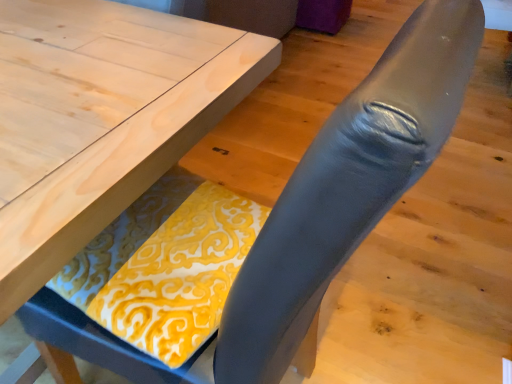
Describe the element at coordinates (165, 265) in the screenshot. This screenshot has width=512, height=384. I see `yellow printed fabric at lower center` at that location.

Locate an element on the screen. The width and height of the screenshot is (512, 384). yellow printed fabric at lower center is located at coordinates tap(165, 265).

What is the approximate width of light wood table at center?

33.26 inches.

I want to click on light wood table at center, so click(101, 118).

Image resolution: width=512 pixels, height=384 pixels. Describe the element at coordinates (101, 118) in the screenshot. I see `light wood table at center` at that location.

Find the location of a particular element. The width and height of the screenshot is (512, 384). yellow printed fabric at lower center is located at coordinates (165, 265).

From the picture: Does yellow printed fabric at lower center appear on the left side of light wood table at center?

No, yellow printed fabric at lower center is not to the left of light wood table at center.

Is the depth of yellow printed fabric at lower center greater than that of light wood table at center?

Yes, yellow printed fabric at lower center is further from the camera.

In the scene shown: Which is less distant, (155, 283) or (136, 50)?

Positioned in front is point (155, 283).

Based on the photo, from the image's perspective, would you say yellow printed fabric at lower center is shown under light wood table at center?

Yes, from the image's perspective, yellow printed fabric at lower center is beneath light wood table at center.

From a real-world perspective, does yellow printed fabric at lower center stand above light wood table at center?

Yes, from a real-world perspective, yellow printed fabric at lower center is on top of light wood table at center.

Between yellow printed fabric at lower center and light wood table at center, which one has larger width?

light wood table at center is wider.

Which of these two, yellow printed fabric at lower center or light wood table at center, stands taller?

With more height is light wood table at center.

Between yellow printed fabric at lower center and light wood table at center, which one has smaller size?

Smaller between the two is yellow printed fabric at lower center.

Is yellow printed fabric at lower center positioned beyond the bounds of light wood table at center?

No, yellow printed fabric at lower center is not entirely external to light wood table at center.

Would you consider yellow printed fabric at lower center to be distant from light wood table at center?

Actually, yellow printed fabric at lower center and light wood table at center are a little close together.

Is yellow printed fabric at lower center positioned with its back to light wood table at center?

Yes, yellow printed fabric at lower center's orientation is away from light wood table at center.

What's the angular difference between yellow printed fabric at lower center and light wood table at center's facing directions?

The facing directions of yellow printed fabric at lower center and light wood table at center are 85.7 degrees apart.

Locate an element on the screen. Image resolution: width=512 pixels, height=384 pixels. blanket above the light wood table at center (from a real-world perspective) is located at coordinates (165, 265).

Which is more to the right, light wood table at center or yellow printed fabric at lower center?

From the viewer's perspective, yellow printed fabric at lower center appears more on the right side.

Is the position of light wood table at center more distant than that of yellow printed fabric at lower center?

That is False.

Considering the points (129, 158) and (144, 194), which point is behind, point (129, 158) or point (144, 194)?

The point (144, 194) is behind.

From the image's perspective, is light wood table at center below yellow printed fabric at lower center?

No, from the image's perspective, light wood table at center is not below yellow printed fabric at lower center.

From a real-world perspective, is light wood table at center positioned above or below yellow printed fabric at lower center?

From a real-world perspective, light wood table at center is physically below yellow printed fabric at lower center.

Which object is wider, light wood table at center or yellow printed fabric at lower center?

light wood table at center is wider.

Between light wood table at center and yellow printed fabric at lower center, which one has less height?

Standing shorter between the two is yellow printed fabric at lower center.

Does light wood table at center have a larger size compared to yellow printed fabric at lower center?

Yes, light wood table at center is bigger than yellow printed fabric at lower center.

Is light wood table at center situated inside yellow printed fabric at lower center or outside?

light wood table at center is outside yellow printed fabric at lower center.

Is light wood table at center in contact with yellow printed fabric at lower center?

light wood table at center and yellow printed fabric at lower center are not in contact.

Is light wood table at center positioned with its back to yellow printed fabric at lower center?

light wood table at center does not have its back to yellow printed fabric at lower center.

How many degrees apart are the facing directions of light wood table at center and yellow printed fabric at lower center?

The angle between the facing direction of light wood table at center and the facing direction of yellow printed fabric at lower center is 85.7 degrees.

This screenshot has height=384, width=512. Find the location of `table that is in front of the yellow printed fabric at lower center`. table that is in front of the yellow printed fabric at lower center is located at coordinates (101, 118).

I want to click on table below the yellow printed fabric at lower center (from a real-world perspective), so click(x=101, y=118).

You are a GUI agent. You are given a task and a screenshot of the screen. Output one action in this format:
    pyautogui.click(x=<x>, y=<y>)
    Task: Click on the table in front of the yellow printed fabric at lower center
    The height and width of the screenshot is (384, 512).
    Given the screenshot: What is the action you would take?
    coord(101,118)